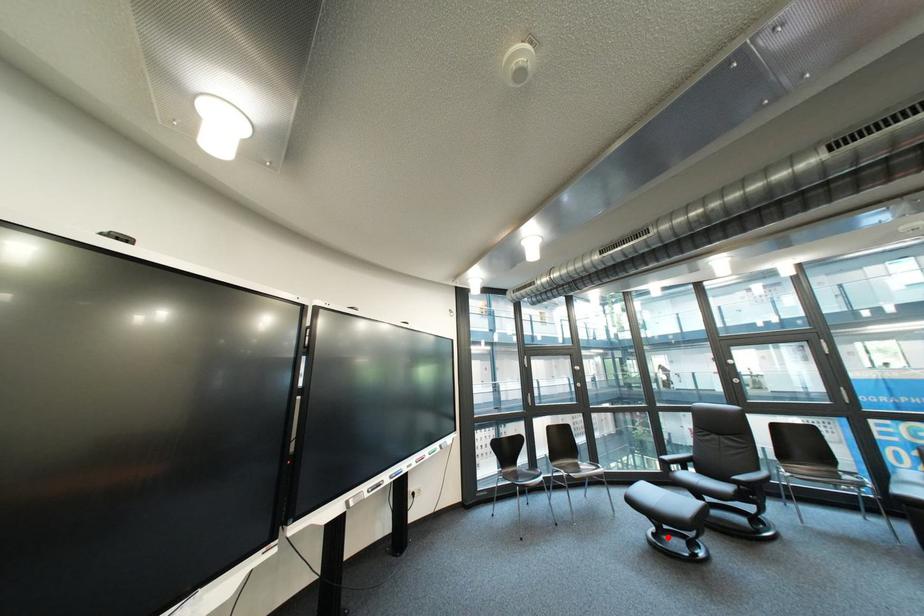
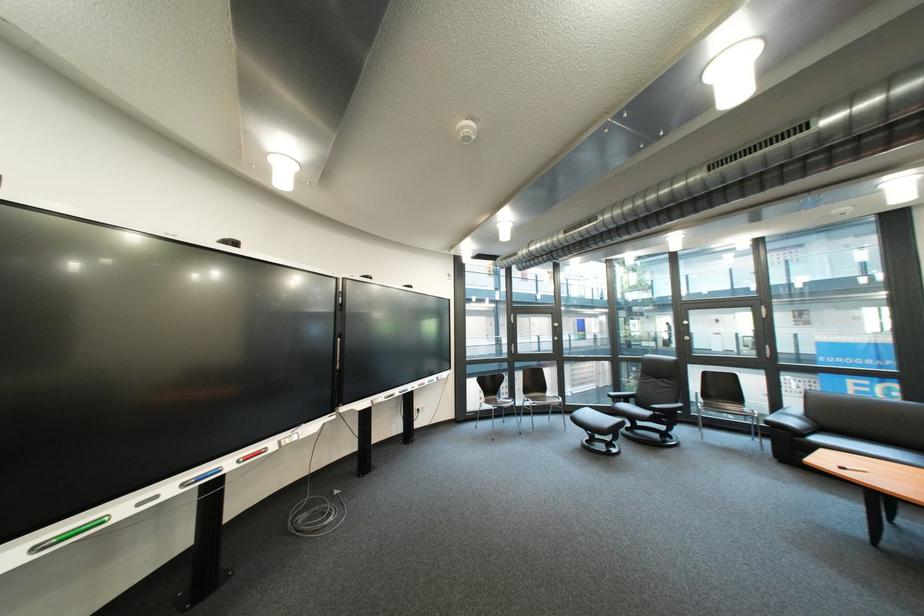
Question: I am providing you with two images of the same scene from different viewpoints. Image1 has a red point marked. In image2, the corresponding 3D location appears at what relative position? Reply with the corresponding letter.

Choices:
 (A) Closer
 (B) Farther

Answer: (B)